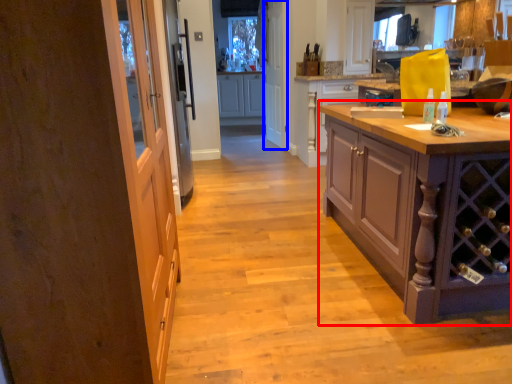
Question: Which point is further to the camera, cabinetry (highlighted by a red box) or screen door (highlighted by a blue box)?

Choices:
 (A) cabinetry
 (B) screen door

Answer: (B)